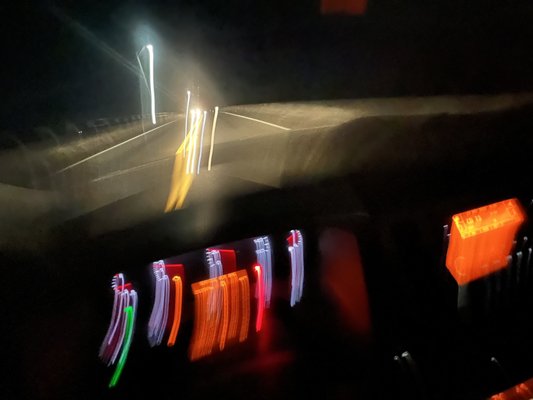
Identify the location of light. (150, 46).